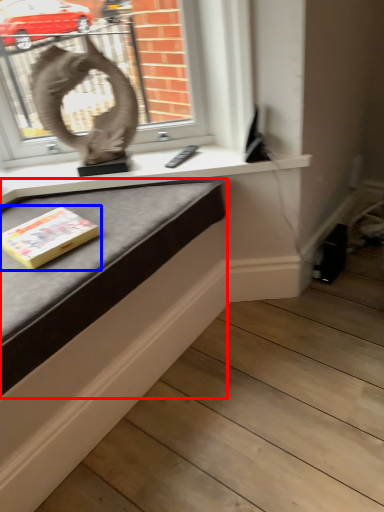
Question: Which object appears farthest to the camera in this image, table (highlighted by a red box) or paperback book (highlighted by a blue box)?

Choices:
 (A) table
 (B) paperback book

Answer: (B)